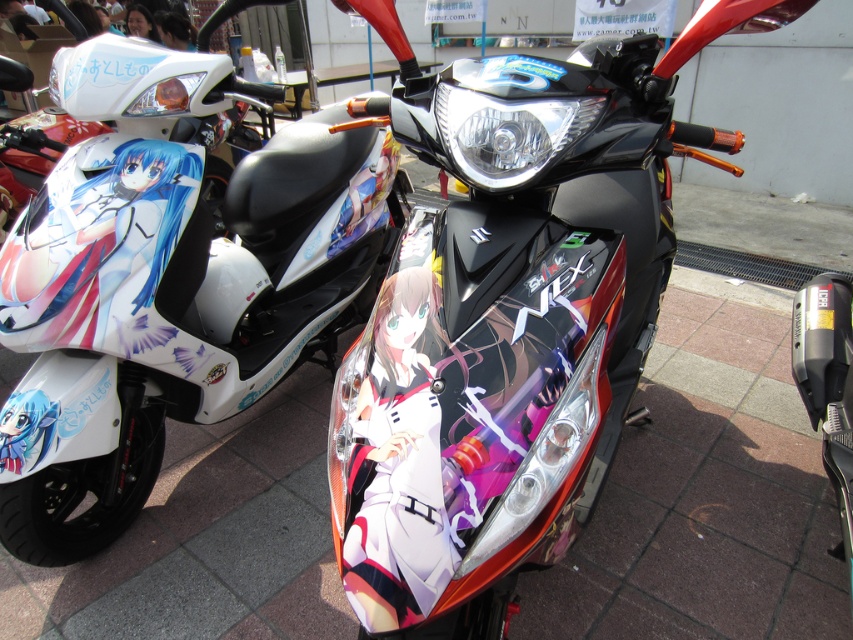
Does glossy black motorcycle at center appear on the left side of white glossy scooter at left?

Incorrect, glossy black motorcycle at center is not on the left side of white glossy scooter at left.

Does point (413, 218) lie behind point (148, 326)?

No.

Who is more distant from viewer, [503,172] or [198,195]?

Point [198,195]

What are the coordinates of `glossy black motorcycle at center` in the screenshot? It's located at (515, 308).